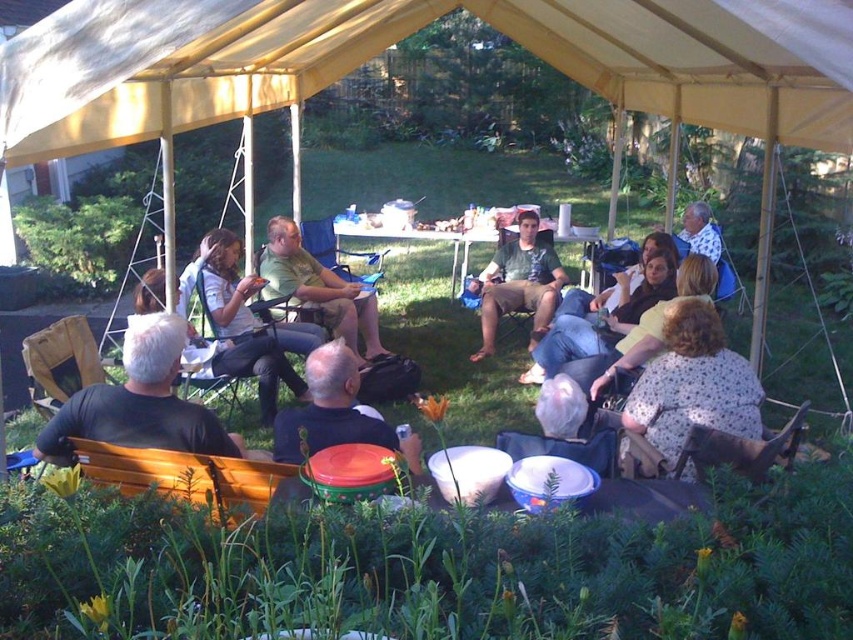
You are organizing a picnic and need to decide where to place a new small cooler. The green matte shirt at center and the wooden folding chair at center are already in the center area. Which object takes up more space in the center area?

The wooden folding chair at center takes up more space in the center area because the green matte shirt at center is smaller than it.